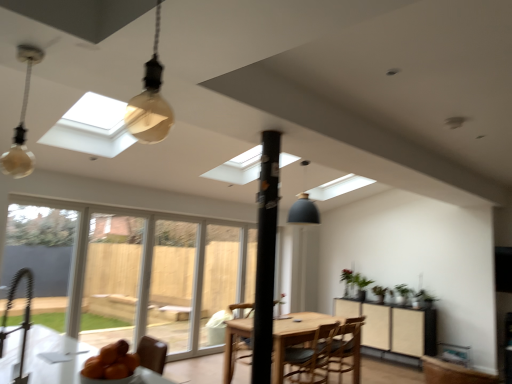
Question: Is matte black cabinet at center right wider than matte glass bulb at upper left?

Choices:
 (A) no
 (B) yes

Answer: (B)

Question: Is matte black cabinet at center right located outside matte glass bulb at upper left?

Choices:
 (A) yes
 (B) no

Answer: (A)

Question: Is matte black cabinet at center right to the right of matte glass bulb at upper left from the viewer's perspective?

Choices:
 (A) no
 (B) yes

Answer: (B)

Question: Does matte black cabinet at center right touch matte glass bulb at upper left?

Choices:
 (A) no
 (B) yes

Answer: (A)

Question: Does matte black cabinet at center right contain matte glass bulb at upper left?

Choices:
 (A) yes
 (B) no

Answer: (B)

Question: From a real-world perspective, relative to matte gray pendant lamp at center, the first light fixture viewed from the back, is translucent glass bulb at upper center, the first light fixture positioned from the left, vertically above or below?

Choices:
 (A) below
 (B) above

Answer: (A)

Question: Based on their positions, is translucent glass bulb at upper center, which is the 2th light fixture in right-to-left order, located to the left or right of matte gray pendant lamp at center, the first light fixture viewed from the back?

Choices:
 (A) right
 (B) left

Answer: (B)

Question: In the image, is translucent glass bulb at upper center, which is the 2th light fixture in right-to-left order, positioned in front of or behind matte gray pendant lamp at center, the first light fixture viewed from the back?

Choices:
 (A) behind
 (B) front

Answer: (B)

Question: From the image's perspective, relative to matte gray pendant lamp at center, placed as the second light fixture when sorted from front to back, is translucent glass bulb at upper center, which is the 1th light fixture from front to back, above or below?

Choices:
 (A) below
 (B) above

Answer: (B)

Question: Based on their positions, is orange matte bowl at lower left located to the left or right of wooden chair at center, placed as the first chair when sorted from back to front?

Choices:
 (A) left
 (B) right

Answer: (A)

Question: Considering the positions of orange matte bowl at lower left and wooden chair at center, acting as the 2th chair starting from the front, in the image, is orange matte bowl at lower left taller or shorter than wooden chair at center, acting as the 2th chair starting from the front,?

Choices:
 (A) tall
 (B) short

Answer: (B)

Question: Is orange matte bowl at lower left bigger or smaller than wooden chair at center, placed as the first chair when sorted from back to front?

Choices:
 (A) small
 (B) big

Answer: (A)

Question: From the image's perspective, is orange matte bowl at lower left above or below wooden chair at center, acting as the 2th chair starting from the front?

Choices:
 (A) above
 (B) below

Answer: (A)

Question: In terms of width, does green matte plant at right look wider or thinner when compared to clear glass door at center, the second screen door viewed from the left?

Choices:
 (A) thin
 (B) wide

Answer: (B)

Question: Considering the positions of green matte plant at right and clear glass door at center, acting as the 2th screen door starting from the back, in the image, is green matte plant at right taller or shorter than clear glass door at center, acting as the 2th screen door starting from the back,?

Choices:
 (A) tall
 (B) short

Answer: (B)